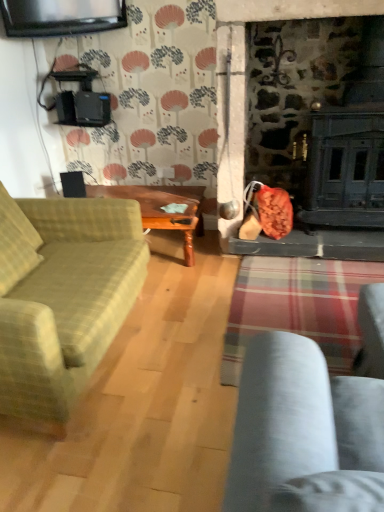
Question: Is the position of green plaid fabric couch at left less distant than that of wooden polished table at center?

Choices:
 (A) yes
 (B) no

Answer: (A)

Question: Is green plaid fabric couch at left bigger than wooden polished table at center?

Choices:
 (A) no
 (B) yes

Answer: (B)

Question: Can you confirm if green plaid fabric couch at left is wider than wooden polished table at center?

Choices:
 (A) no
 (B) yes

Answer: (B)

Question: Is green plaid fabric couch at left not within wooden polished table at center?

Choices:
 (A) yes
 (B) no

Answer: (A)

Question: Is the depth of green plaid fabric couch at left greater than that of wooden polished table at center?

Choices:
 (A) no
 (B) yes

Answer: (A)

Question: Can you confirm if green plaid fabric couch at left is positioned to the right of wooden polished table at center?

Choices:
 (A) yes
 (B) no

Answer: (B)

Question: Is wooden polished table at center bigger than green plaid fabric couch at left?

Choices:
 (A) yes
 (B) no

Answer: (B)

Question: Is wooden polished table at center beside green plaid fabric couch at left?

Choices:
 (A) yes
 (B) no

Answer: (B)

Question: Can you confirm if wooden polished table at center is wider than green plaid fabric couch at left?

Choices:
 (A) no
 (B) yes

Answer: (A)

Question: Considering the relative sizes of wooden polished table at center and green plaid fabric couch at left in the image provided, is wooden polished table at center shorter than green plaid fabric couch at left?

Choices:
 (A) no
 (B) yes

Answer: (B)

Question: Does wooden polished table at center turn towards green plaid fabric couch at left?

Choices:
 (A) yes
 (B) no

Answer: (A)

Question: Considering the relative positions of wooden polished table at center and green plaid fabric couch at left in the image provided, is wooden polished table at center in front of green plaid fabric couch at left?

Choices:
 (A) yes
 (B) no

Answer: (B)

Question: Is wooden polished table at center inside the boundaries of green plaid fabric couch at left, or outside?

Choices:
 (A) outside
 (B) inside

Answer: (A)